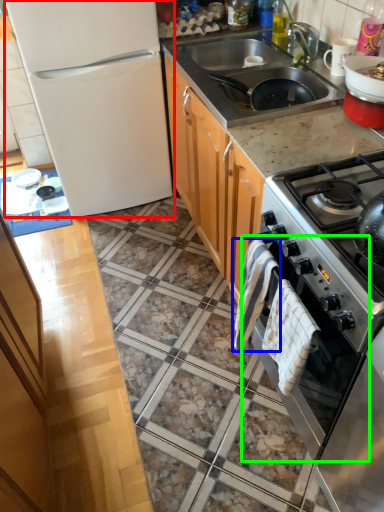
Question: Based on their relative distances, which object is nearer to refrigerator (highlighted by a red box)? Choose from blanket (highlighted by a blue box) and oven (highlighted by a green box).

Choices:
 (A) blanket
 (B) oven

Answer: (A)